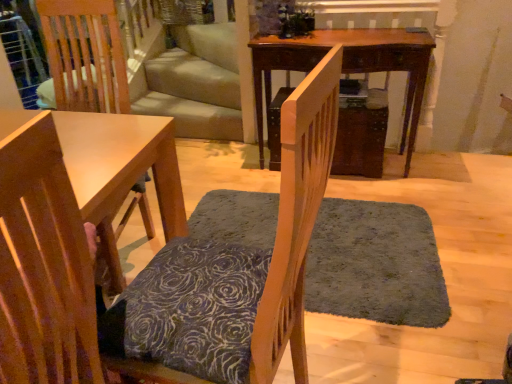
The width and height of the screenshot is (512, 384). What do you see at coordinates (234, 273) in the screenshot?
I see `wooden chair with patterned cushion at center, which appears as the 1th chair when viewed from the right` at bounding box center [234, 273].

I want to click on wooden chair with patterned cushion at center, acting as the second chair starting from the left, so click(234, 273).

Find the location of a particular element. The image size is (512, 384). mahogany wood table at center is located at coordinates (348, 66).

Measure the distance between point (x=79, y=344) and camera.

A distance of 27.60 inches exists between point (x=79, y=344) and camera.

Image resolution: width=512 pixels, height=384 pixels. I want to click on wooden chair with patterned cushion at center, acting as the second chair starting from the left, so point(234,273).

From the image's perspective, is wooden chair at lower left, arranged as the second chair when viewed from the right, above mahogany wood table at center?

Actually, wooden chair at lower left, arranged as the second chair when viewed from the right, appears below mahogany wood table at center in the image.

From a real-world perspective, who is located lower, wooden chair at lower left, which ranks as the first chair in left-to-right order, or mahogany wood table at center?

In real-world perspective, mahogany wood table at center is lower.

Is dark gray shaggy rug at center not close to wooden chair with patterned cushion at center, acting as the second chair starting from the left?

They are positioned close to each other.

Is dark gray shaggy rug at center oriented towards wooden chair with patterned cushion at center, which appears as the 1th chair when viewed from the right?

No, dark gray shaggy rug at center is not turned towards wooden chair with patterned cushion at center, which appears as the 1th chair when viewed from the right.

Looking at this image, how far apart are dark gray shaggy rug at center and wooden chair with patterned cushion at center, which appears as the 1th chair when viewed from the right?

dark gray shaggy rug at center is 30.85 inches from wooden chair with patterned cushion at center, which appears as the 1th chair when viewed from the right.

How different are the orientations of dark gray shaggy rug at center and wooden chair with patterned cushion at center, which appears as the 1th chair when viewed from the right, in degrees?

There is a 98.7-degree angle between the facing directions of dark gray shaggy rug at center and wooden chair with patterned cushion at center, which appears as the 1th chair when viewed from the right.

Considering the relative positions of wooden chair at lower left, arranged as the second chair when viewed from the right, and dark gray shaggy rug at center in the image provided, is wooden chair at lower left, arranged as the second chair when viewed from the right, to the left of dark gray shaggy rug at center from the viewer's perspective?

Correct, you'll find wooden chair at lower left, arranged as the second chair when viewed from the right, to the left of dark gray shaggy rug at center.

From a real-world perspective, which object rests below the other?

dark gray shaggy rug at center is physically lower.

Is wooden chair at lower left, which ranks as the first chair in left-to-right order, further to the viewer compared to dark gray shaggy rug at center?

No, it is in front of dark gray shaggy rug at center.

Is wooden chair at lower left, arranged as the second chair when viewed from the right, not near dark gray shaggy rug at center?

Indeed, wooden chair at lower left, arranged as the second chair when viewed from the right, is not near dark gray shaggy rug at center.

From a real-world perspective, is mahogany wood table at center located beneath dark gray shaggy rug at center?

No, from a real-world perspective, mahogany wood table at center is not under dark gray shaggy rug at center.

From the image's perspective, is mahogany wood table at center beneath dark gray shaggy rug at center?

No, from the image's perspective, mahogany wood table at center is not beneath dark gray shaggy rug at center.

The width and height of the screenshot is (512, 384). I want to click on table lying on the right of dark gray shaggy rug at center, so [x=348, y=66].

Can you confirm if mahogany wood table at center is shorter than dark gray shaggy rug at center?

No, mahogany wood table at center is not shorter than dark gray shaggy rug at center.

Considering the relative sizes of wooden chair with patterned cushion at center, which appears as the 1th chair when viewed from the right, and mahogany wood table at center in the image provided, is wooden chair with patterned cushion at center, which appears as the 1th chair when viewed from the right, wider than mahogany wood table at center?

Yes.

Is wooden chair with patterned cushion at center, which appears as the 1th chair when viewed from the right, facing away from mahogany wood table at center?

No, wooden chair with patterned cushion at center, which appears as the 1th chair when viewed from the right, is not facing the opposite direction of mahogany wood table at center.

Which is more to the right, wooden chair with patterned cushion at center, acting as the second chair starting from the left, or mahogany wood table at center?

mahogany wood table at center is more to the right.

Does wooden chair with patterned cushion at center, acting as the second chair starting from the left, contain mahogany wood table at center?

Actually, mahogany wood table at center is outside wooden chair with patterned cushion at center, acting as the second chair starting from the left.

How distant is wooden chair at lower left, which ranks as the first chair in left-to-right order, from wooden chair with patterned cushion at center, acting as the second chair starting from the left?

12.56 inches.

From the image's perspective, is wooden chair at lower left, arranged as the second chair when viewed from the right, positioned above or below wooden chair with patterned cushion at center, acting as the second chair starting from the left?

wooden chair at lower left, arranged as the second chair when viewed from the right, is situated lower than wooden chair with patterned cushion at center, acting as the second chair starting from the left, in the image.

Is wooden chair with patterned cushion at center, which appears as the 1th chair when viewed from the right, inside wooden chair at lower left, which ranks as the first chair in left-to-right order?

No, wooden chair with patterned cushion at center, which appears as the 1th chair when viewed from the right, is not a part of wooden chair at lower left, which ranks as the first chair in left-to-right order.

Identify the location of chair above the wooden chair with patterned cushion at center, acting as the second chair starting from the left (from a real-world perspective). (42, 266).

Is point (275, 329) in front of point (22, 164)?

No, it is behind (22, 164).

From a real-world perspective, which object stands above the other?

In real-world perspective, wooden chair at lower left, arranged as the second chair when viewed from the right, is above.

Which object is positioned more to the left, wooden chair with patterned cushion at center, which appears as the 1th chair when viewed from the right, or wooden chair at lower left, arranged as the second chair when viewed from the right?

wooden chair at lower left, arranged as the second chair when viewed from the right.

From the image's perspective, is wooden chair with patterned cushion at center, acting as the second chair starting from the left, below wooden chair at lower left, which ranks as the first chair in left-to-right order?

No, from the image's perspective, wooden chair with patterned cushion at center, acting as the second chair starting from the left, is not beneath wooden chair at lower left, which ranks as the first chair in left-to-right order.

Starting from the mahogany wood table at center, which chair is the 2nd one in front? Please provide its 2D coordinates.

[(42, 266)]

Find the location of `doormat below the wooden chair with patterned cushion at center, which appears as the 1th chair when viewed from the right (from a real-world perspective)`. doormat below the wooden chair with patterned cushion at center, which appears as the 1th chair when viewed from the right (from a real-world perspective) is located at coordinates (376, 264).

Which object lies nearer to the anchor point wooden chair with patterned cushion at center, acting as the second chair starting from the left, mahogany wood table at center or wooden chair at lower left, which ranks as the first chair in left-to-right order?

wooden chair at lower left, which ranks as the first chair in left-to-right order.

Which object lies further to the anchor point mahogany wood table at center, dark gray shaggy rug at center or wooden chair at lower left, which ranks as the first chair in left-to-right order?

wooden chair at lower left, which ranks as the first chair in left-to-right order, is positioned further to the anchor mahogany wood table at center.

Based on their spatial positions, is wooden chair with patterned cushion at center, which appears as the 1th chair when viewed from the right, or wooden chair at lower left, which ranks as the first chair in left-to-right order, further from mahogany wood table at center?

The object further to mahogany wood table at center is wooden chair at lower left, which ranks as the first chair in left-to-right order.

From the image, which object appears to be farther from dark gray shaggy rug at center, mahogany wood table at center or wooden chair at lower left, which ranks as the first chair in left-to-right order?

wooden chair at lower left, which ranks as the first chair in left-to-right order.

Looking at the image, which one is located closer to wooden chair at lower left, which ranks as the first chair in left-to-right order, mahogany wood table at center or dark gray shaggy rug at center?

dark gray shaggy rug at center lies closer to wooden chair at lower left, which ranks as the first chair in left-to-right order, than the other object.

When comparing their distances from dark gray shaggy rug at center, does wooden chair at lower left, arranged as the second chair when viewed from the right, or wooden chair with patterned cushion at center, which appears as the 1th chair when viewed from the right, seem further?

wooden chair at lower left, arranged as the second chair when viewed from the right, is positioned further to the anchor dark gray shaggy rug at center.

Considering their positions, is dark gray shaggy rug at center positioned further to wooden chair at lower left, arranged as the second chair when viewed from the right, than wooden chair with patterned cushion at center, which appears as the 1th chair when viewed from the right?

Based on the image, dark gray shaggy rug at center appears to be further to wooden chair at lower left, arranged as the second chair when viewed from the right.

Estimate the real-world distances between objects in this image. Which object is closer to wooden chair with patterned cushion at center, which appears as the 1th chair when viewed from the right, dark gray shaggy rug at center or wooden chair at lower left, which ranks as the first chair in left-to-right order?

wooden chair at lower left, which ranks as the first chair in left-to-right order, is closer to wooden chair with patterned cushion at center, which appears as the 1th chair when viewed from the right.

At what (x,y) coordinates should I click in order to perform the action: click on chair between wooden chair at lower left, arranged as the second chair when viewed from the right, and mahogany wood table at center in the front-back direction. Please return your answer as a coordinate pair (x, y). The height and width of the screenshot is (384, 512). Looking at the image, I should click on (234, 273).

Where is `doormat between wooden chair with patterned cushion at center, acting as the second chair starting from the left, and mahogany wood table at center from front to back`? doormat between wooden chair with patterned cushion at center, acting as the second chair starting from the left, and mahogany wood table at center from front to back is located at coordinates (376, 264).

Where is `doormat between wooden chair at lower left, arranged as the second chair when viewed from the right, and mahogany wood table at center, along the z-axis`? The width and height of the screenshot is (512, 384). doormat between wooden chair at lower left, arranged as the second chair when viewed from the right, and mahogany wood table at center, along the z-axis is located at coordinates (376, 264).

Where is `chair between wooden chair at lower left, arranged as the second chair when viewed from the right, and dark gray shaggy rug at center from front to back`? The image size is (512, 384). chair between wooden chair at lower left, arranged as the second chair when viewed from the right, and dark gray shaggy rug at center from front to back is located at coordinates (234, 273).